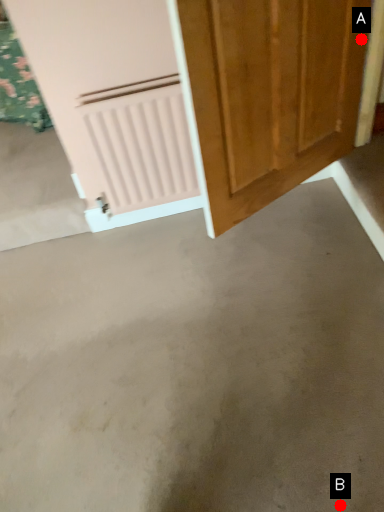
Question: Two points are circled on the image, labeled by A and B beside each circle. Which point is closer to the camera taking this photo?

Choices:
 (A) A is closer
 (B) B is closer

Answer: (B)